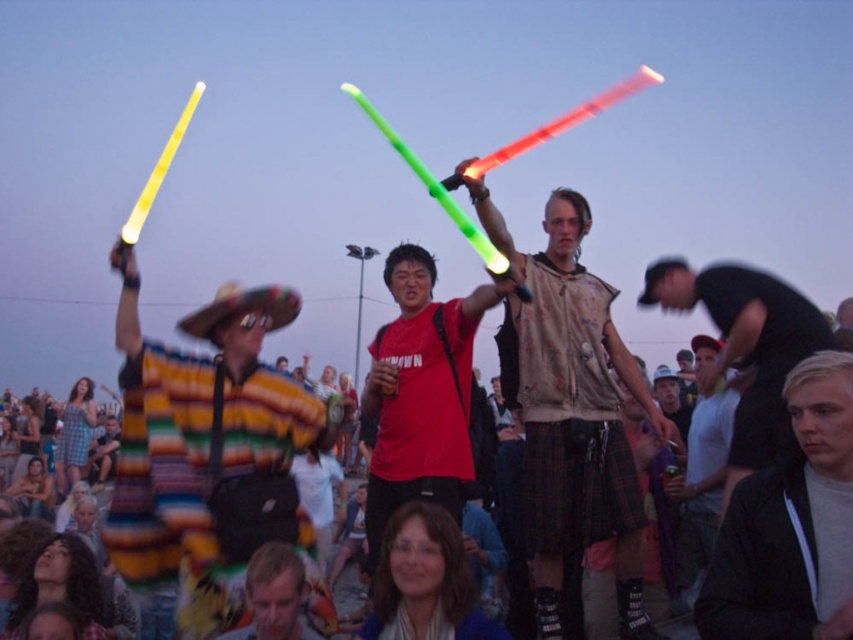
Question: Which object is farther from the camera taking this photo?

Choices:
 (A) matte red t-shirt at center
 (B) multicolored woven poncho at left
 (C) matte brown vest at center

Answer: (A)

Question: Does black matte shirt at right have a smaller size compared to blonde hair at lower center?

Choices:
 (A) yes
 (B) no

Answer: (B)

Question: In this image, where is multicolored woven poncho at left located relative to matte red t-shirt at center?

Choices:
 (A) below
 (B) above

Answer: (A)

Question: Which is nearer to the white cotton t-shirt at center?

Choices:
 (A) black matte shirt at right
 (B) matte red t-shirt at center
 (C) matte brown vest at center
 (D) multicolored woven poncho at left

Answer: (A)

Question: In this image, where is multicolored woven poncho at left located relative to matte brown vest at center?

Choices:
 (A) left
 (B) right

Answer: (A)

Question: Which of these objects is positioned closest to the matte red t-shirt at center?

Choices:
 (A) blonde hair at lower center
 (B) matte brown vest at center

Answer: (B)